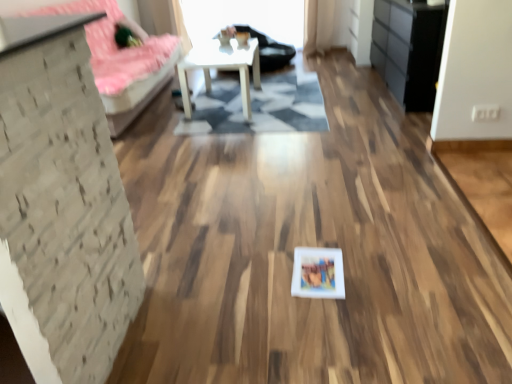
Locate an element on the screen. This screenshot has width=512, height=384. vacant area situated to the left side of matte white picture frame at center is located at coordinates (263, 275).